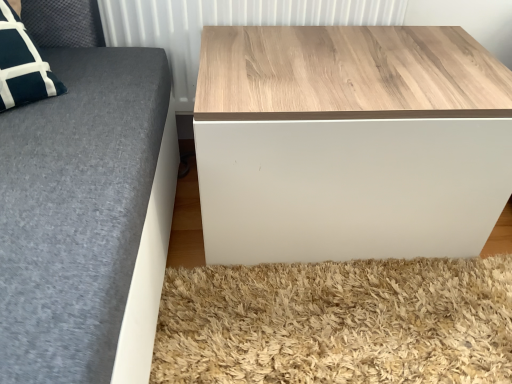
Question: Does point (293, 69) appear closer or farther from the camera than point (232, 6)?

Choices:
 (A) farther
 (B) closer

Answer: (B)

Question: Looking at their shapes, would you say wooden table at lower right is wider or thinner than wooden panel at upper center?

Choices:
 (A) thin
 (B) wide

Answer: (B)

Question: Do you think wooden table at lower right is within wooden panel at upper center, or outside of it?

Choices:
 (A) inside
 (B) outside

Answer: (B)

Question: Does point pyautogui.click(x=153, y=24) appear closer or farther from the camera than point pyautogui.click(x=260, y=102)?

Choices:
 (A) farther
 (B) closer

Answer: (A)

Question: From the image's perspective, is wooden panel at upper center above or below wooden table at lower right?

Choices:
 (A) above
 (B) below

Answer: (A)

Question: Is wooden panel at upper center bigger or smaller than wooden table at lower right?

Choices:
 (A) small
 (B) big

Answer: (A)

Question: Based on their positions, is wooden panel at upper center located to the left or right of wooden table at lower right?

Choices:
 (A) right
 (B) left

Answer: (B)